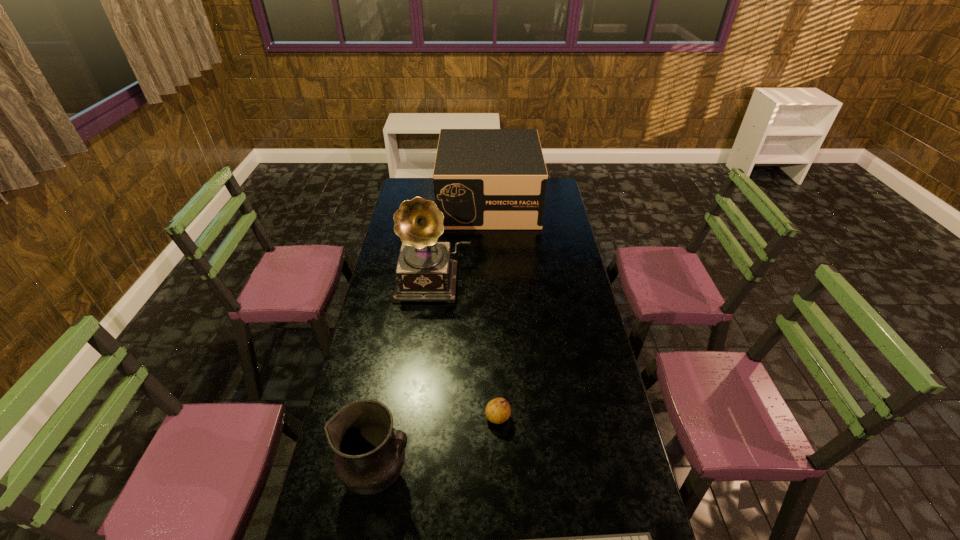
Where is `free spot that satisfies the following two spatial constraints: 1. on the front-facing side of the farthest object; 2. on the left side of the fourth tallest object`? Image resolution: width=960 pixels, height=540 pixels. free spot that satisfies the following two spatial constraints: 1. on the front-facing side of the farthest object; 2. on the left side of the fourth tallest object is located at coordinates (494, 417).

Where is `vacant region that satisfies the following two spatial constraints: 1. on the horn of the second farthest object; 2. on the handle side of the pitcher`? vacant region that satisfies the following two spatial constraints: 1. on the horn of the second farthest object; 2. on the handle side of the pitcher is located at coordinates (411, 476).

I want to click on vacant space that satisfies the following two spatial constraints: 1. on the front-facing side of the box; 2. on the handle side of the fourth farthest object, so click(x=496, y=476).